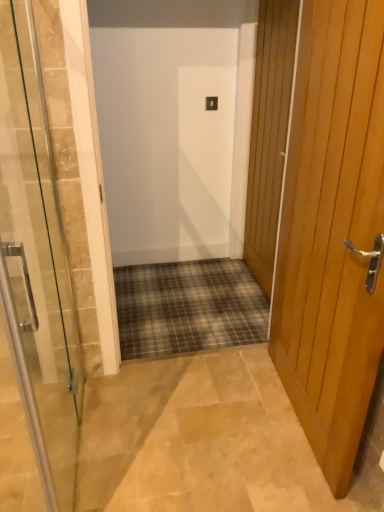
Question: Would you say wooden door at right, positioned as the first door in right-to-left order, is outside clear glass door at center, the third door in the right-to-left sequence?

Choices:
 (A) yes
 (B) no

Answer: (A)

Question: Is wooden door at right, positioned as the first door in right-to-left order, positioned with its back to clear glass door at center, the third door in the right-to-left sequence?

Choices:
 (A) no
 (B) yes

Answer: (A)

Question: Can you confirm if wooden door at right, positioned as the first door in right-to-left order, is thinner than clear glass door at center, the third door in the right-to-left sequence?

Choices:
 (A) no
 (B) yes

Answer: (A)

Question: Can you confirm if wooden door at right, which is the 3th door from left to right, is positioned to the right of clear glass door at center, acting as the first door starting from the left?

Choices:
 (A) yes
 (B) no

Answer: (A)

Question: From the image's perspective, is wooden door at right, positioned as the first door in right-to-left order, above clear glass door at center, the third door in the right-to-left sequence?

Choices:
 (A) yes
 (B) no

Answer: (A)

Question: From their relative heights in the image, would you say wooden door at right, which is the 3th door from left to right, is taller or shorter than light brown wooden door at right, the 2th door positioned from the right?

Choices:
 (A) tall
 (B) short

Answer: (A)

Question: Considering the positions of wooden door at right, which is the 3th door from left to right, and light brown wooden door at right, the 2th door positioned from the right, in the image, is wooden door at right, which is the 3th door from left to right, bigger or smaller than light brown wooden door at right, the 2th door positioned from the right,?

Choices:
 (A) small
 (B) big

Answer: (A)

Question: From the image's perspective, relative to light brown wooden door at right, which appears as the second door when viewed from the left, is wooden door at right, positioned as the first door in right-to-left order, above or below?

Choices:
 (A) below
 (B) above

Answer: (B)

Question: In the image, is wooden door at right, positioned as the first door in right-to-left order, positioned in front of or behind light brown wooden door at right, the 2th door positioned from the right?

Choices:
 (A) front
 (B) behind

Answer: (B)

Question: Is light brown wooden door at right, which appears as the second door when viewed from the left, spatially inside wooden door at right, which is the 3th door from left to right, or outside of it?

Choices:
 (A) outside
 (B) inside

Answer: (A)

Question: Considering the positions of light brown wooden door at right, which appears as the second door when viewed from the left, and wooden door at right, which is the 3th door from left to right, in the image, is light brown wooden door at right, which appears as the second door when viewed from the left, taller or shorter than wooden door at right, which is the 3th door from left to right,?

Choices:
 (A) short
 (B) tall

Answer: (A)

Question: From the image's perspective, relative to wooden door at right, positioned as the first door in right-to-left order, is light brown wooden door at right, which appears as the second door when viewed from the left, above or below?

Choices:
 (A) below
 (B) above

Answer: (A)

Question: From a real-world perspective, is light brown wooden door at right, which appears as the second door when viewed from the left, physically located above or below wooden door at right, which is the 3th door from left to right?

Choices:
 (A) below
 (B) above

Answer: (A)

Question: Considering the relative positions of wooden door at right, positioned as the first door in right-to-left order, and clear glass door at center, the third door in the right-to-left sequence, in the image provided, is wooden door at right, positioned as the first door in right-to-left order, to the left or to the right of clear glass door at center, the third door in the right-to-left sequence,?

Choices:
 (A) left
 (B) right

Answer: (B)

Question: In the image, is wooden door at right, positioned as the first door in right-to-left order, positioned in front of or behind clear glass door at center, the third door in the right-to-left sequence?

Choices:
 (A) front
 (B) behind

Answer: (B)